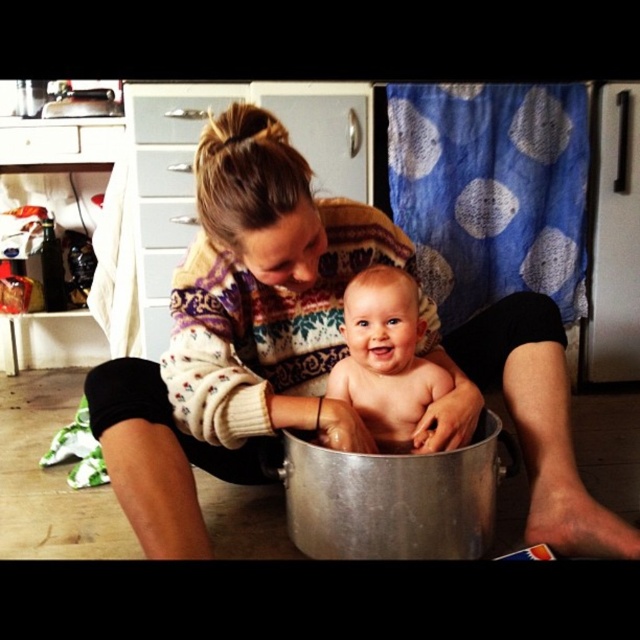
Which is above, white knitted sweater at center or smooth skin baby at center?

smooth skin baby at center is higher up.

Who is more distant from viewer, (253, 204) or (388, 449)?

The point (388, 449) is more distant.

What do you see at coordinates (237, 333) in the screenshot? The height and width of the screenshot is (640, 640). I see `white knitted sweater at center` at bounding box center [237, 333].

At what (x,y) coordinates should I click in order to perform the action: click on white knitted sweater at center. Please return your answer as a coordinate pair (x, y). This screenshot has width=640, height=640. Looking at the image, I should click on [237, 333].